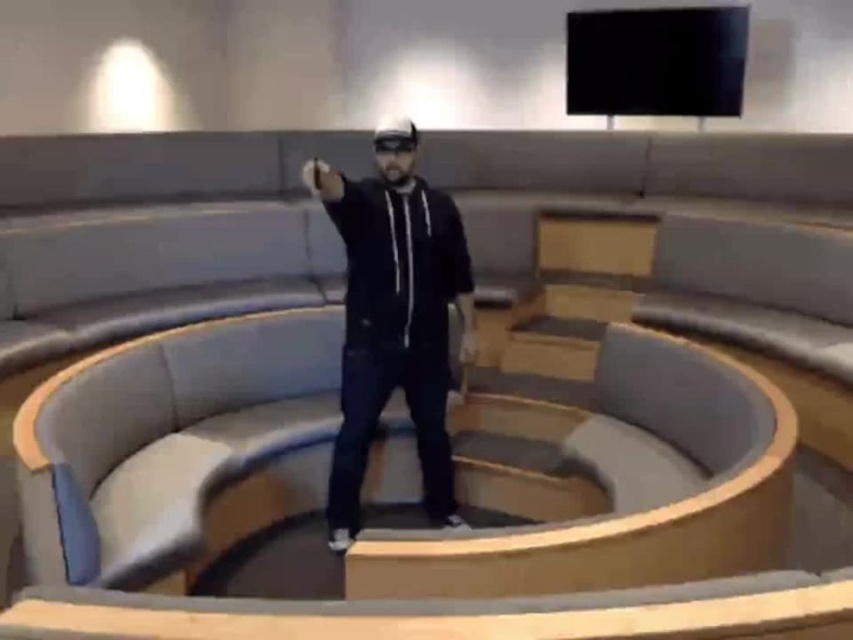
Question: Does black matte hoodie at center appear under black matte goggles at center?

Choices:
 (A) yes
 (B) no

Answer: (A)

Question: Is black matte hoodie at center bigger than black matte goggles at center?

Choices:
 (A) no
 (B) yes

Answer: (B)

Question: From the image, what is the correct spatial relationship of black matte hoodie at center in relation to black matte goggles at center?

Choices:
 (A) right
 (B) left

Answer: (B)